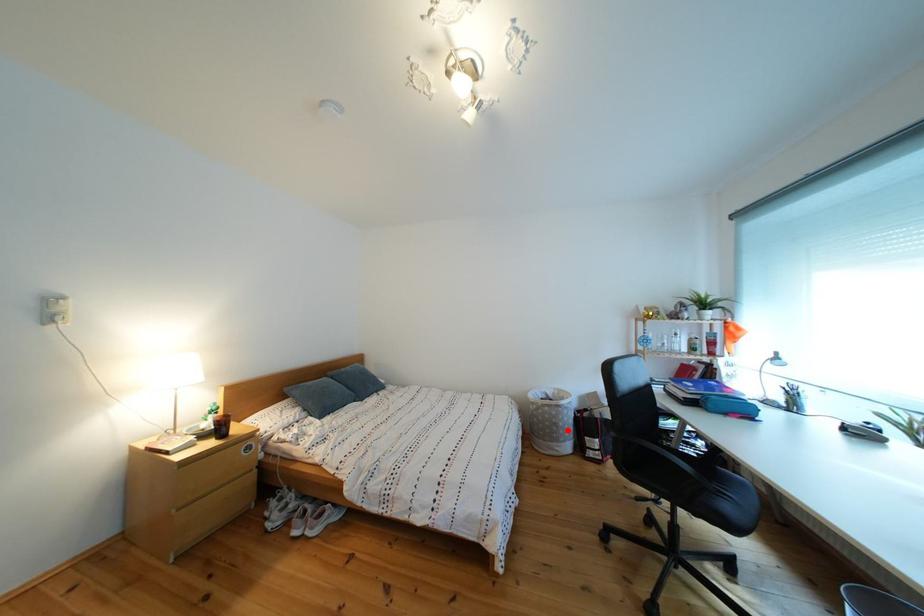
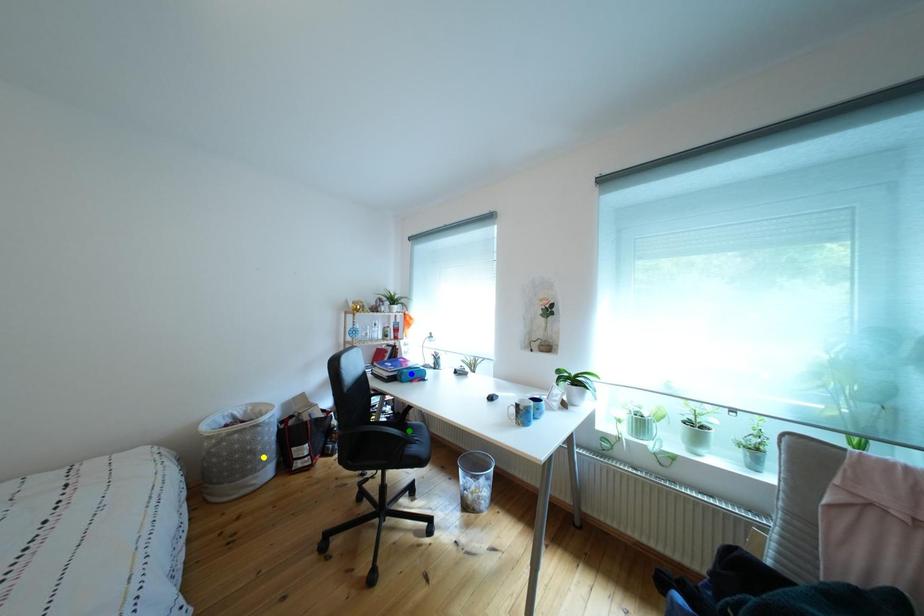
Question: I am providing you with two images of the same scene from different viewpoints. A red point is marked on the first image. You are given multiple points on the second image. Which point in image 2 represents the same 3d spot as the red point in image 1?

Choices:
 (A) blue point
 (B) green point
 (C) yellow point

Answer: (C)